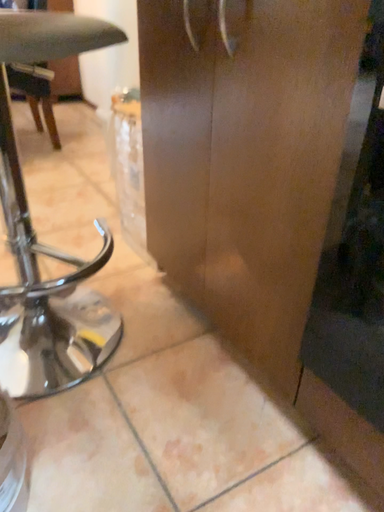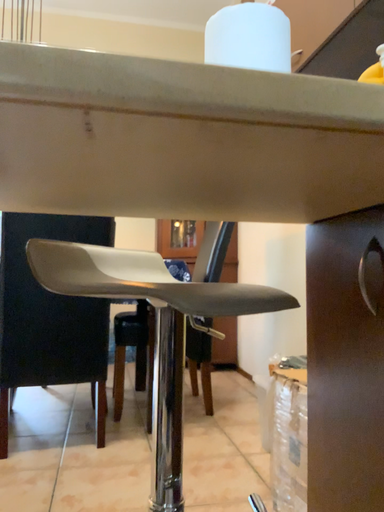
Question: Which way did the camera rotate in the video?

Choices:
 (A) rotated right
 (B) rotated left

Answer: (B)